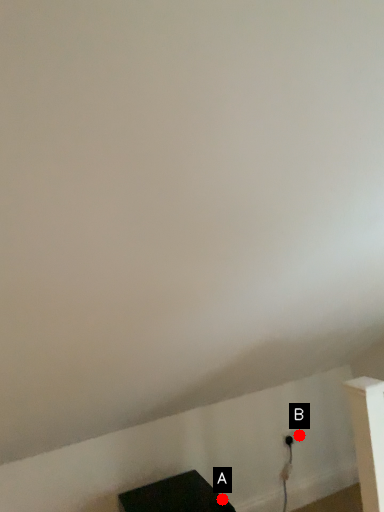
Question: Two points are circled on the image, labeled by A and B beside each circle. Which point is closer to the camera taking this photo?

Choices:
 (A) A is closer
 (B) B is closer

Answer: (A)